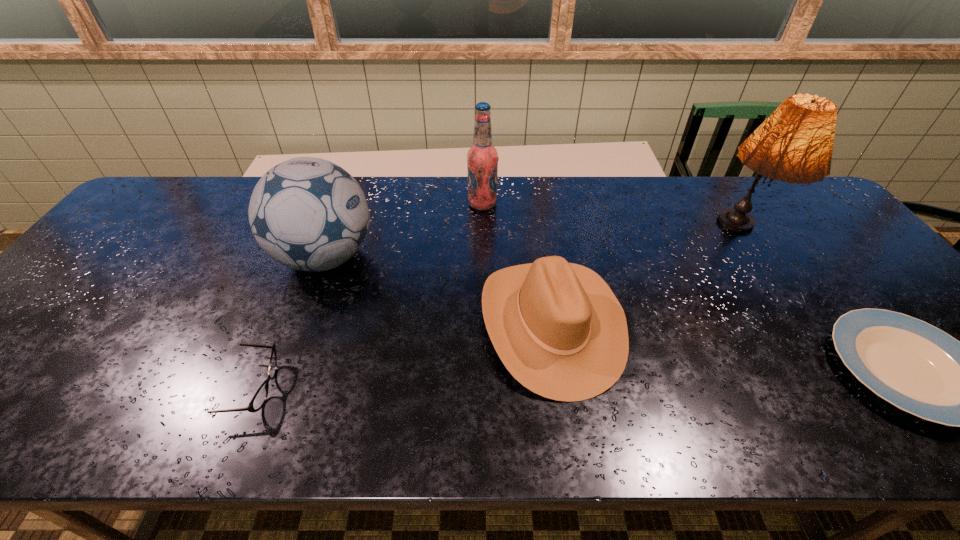
Locate an element on the screen. The image size is (960, 540). unoccupied area between the third shortest object and the lampshade is located at coordinates (644, 280).

Where is `empty space between the third shortest object and the second shortest object`? empty space between the third shortest object and the second shortest object is located at coordinates (402, 355).

Locate an element on the screen. The width and height of the screenshot is (960, 540). vacant point located between the second shortest object and the soccer ball is located at coordinates (290, 323).

Find the location of a particular element. The image size is (960, 540). empty location between the soccer ball and the alcohol is located at coordinates (404, 231).

Image resolution: width=960 pixels, height=540 pixels. What are the coordinates of `object that can be found as the fourth closest to the cowboy hat` in the screenshot? It's located at (259, 399).

At what (x,y) coordinates should I click in order to perform the action: click on object that can be found as the closest to the shortest object. Please return your answer as a coordinate pair (x, y). Looking at the image, I should click on (794, 144).

I want to click on vacant space that satisfies the following two spatial constraints: 1. on the side with brand of the soccer ball; 2. on the back side of the cowboy hat, so click(x=301, y=323).

You are a GUI agent. You are given a task and a screenshot of the screen. Output one action in this format:
    pyautogui.click(x=<x>, y=<y>)
    Task: Click on the vacant region that satisfies the following two spatial constraints: 1. on the front side of the alcohol; 2. on the side with brand of the soccer ball
    The image size is (960, 540).
    Given the screenshot: What is the action you would take?
    pyautogui.click(x=483, y=258)

The height and width of the screenshot is (540, 960). I want to click on free space that satisfies the following two spatial constraints: 1. on the back side of the cowboy hat; 2. on the side with brand of the soccer ball, so click(541, 258).

Locate an element on the screen. The height and width of the screenshot is (540, 960). blank space that satisfies the following two spatial constraints: 1. on the side with brand of the third shortest object; 2. on the left side of the soccer ball is located at coordinates (301, 323).